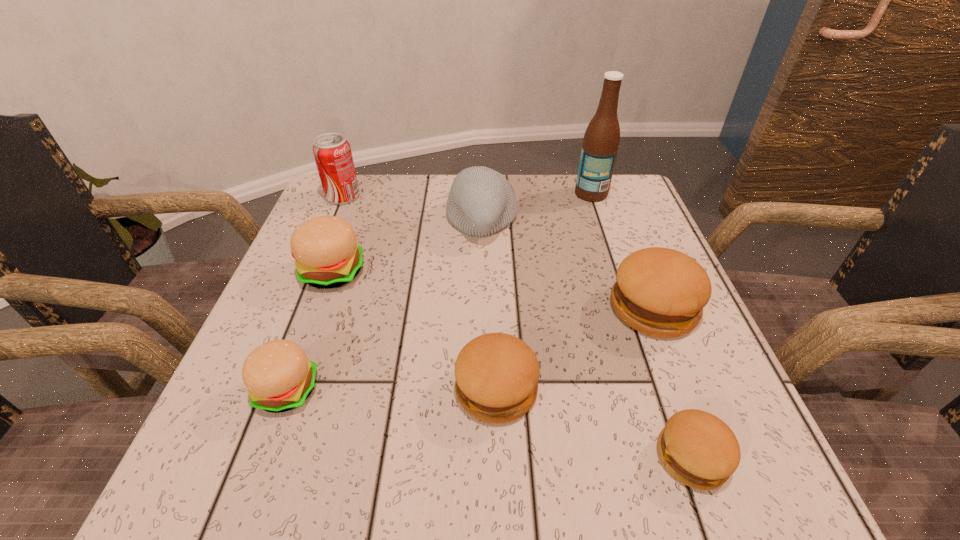
Locate an element on the screen. free point at the left edge is located at coordinates (226, 409).

I want to click on vacant space at the right edge, so click(x=639, y=230).

Where is `free spot at the far left corner of the desktop`? The image size is (960, 540). free spot at the far left corner of the desktop is located at coordinates (347, 218).

You are a GUI agent. You are given a task and a screenshot of the screen. Output one action in this format:
    pyautogui.click(x=<x>, y=<y>)
    Task: Click on the free space at the far right corner
    
    Given the screenshot: What is the action you would take?
    pyautogui.click(x=592, y=220)

Find the location of a particular element. empty space between the bigger beige hamburger and the tallest object is located at coordinates (462, 233).

The width and height of the screenshot is (960, 540). Find the location of `vacant space that is in between the smaller beige hamburger and the beanie`. vacant space that is in between the smaller beige hamburger and the beanie is located at coordinates (384, 305).

You are a GUI agent. You are given a task and a screenshot of the screen. Output one action in this format:
    pyautogui.click(x=<x>, y=<y>)
    Task: Click on the empty space that is in between the beer bottle and the nearer beige hamburger
    Image resolution: width=960 pixels, height=540 pixels.
    Given the screenshot: What is the action you would take?
    pyautogui.click(x=439, y=292)

At what (x,y) coordinates should I click in order to perform the action: click on blank region between the smaller beige hamburger and the second biggest brown hamburger. Please return your answer as a coordinate pair (x, y). The width and height of the screenshot is (960, 540). Looking at the image, I should click on (392, 389).

This screenshot has width=960, height=540. In order to click on vacant space in between the second biggest brown hamburger and the shortest object in this screenshot , I will do `click(594, 423)`.

Identify the location of blank region between the shortest hamburger and the gray beanie. (587, 339).